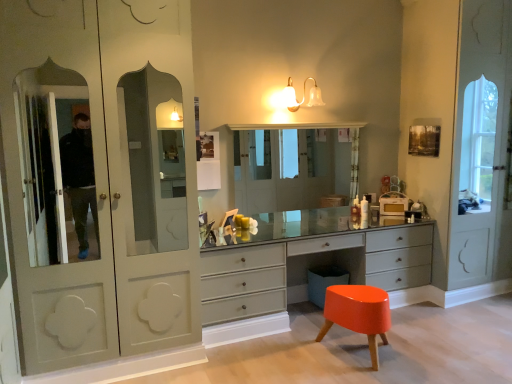
This screenshot has width=512, height=384. In order to click on free location to the left of orange glossy stool at lower right in this screenshot , I will do `click(298, 358)`.